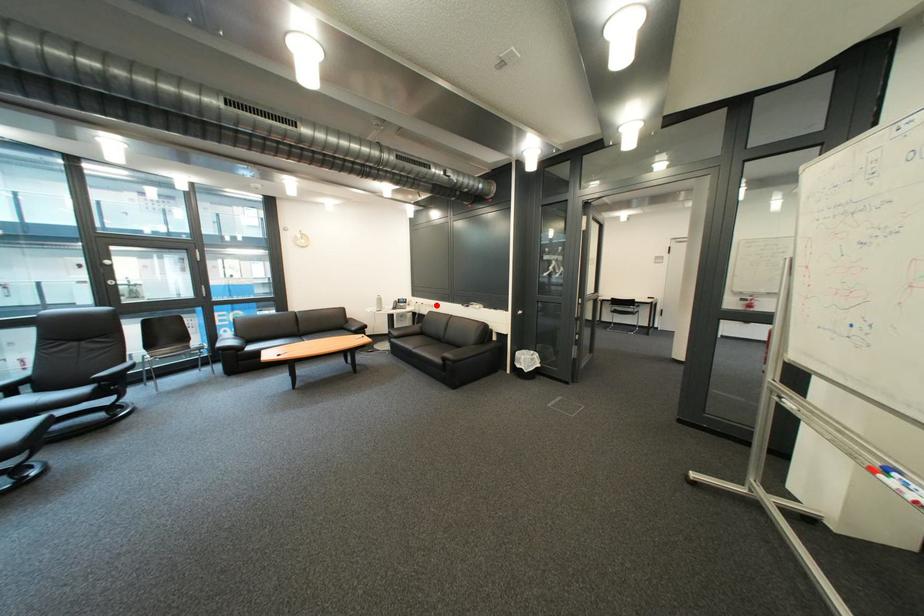
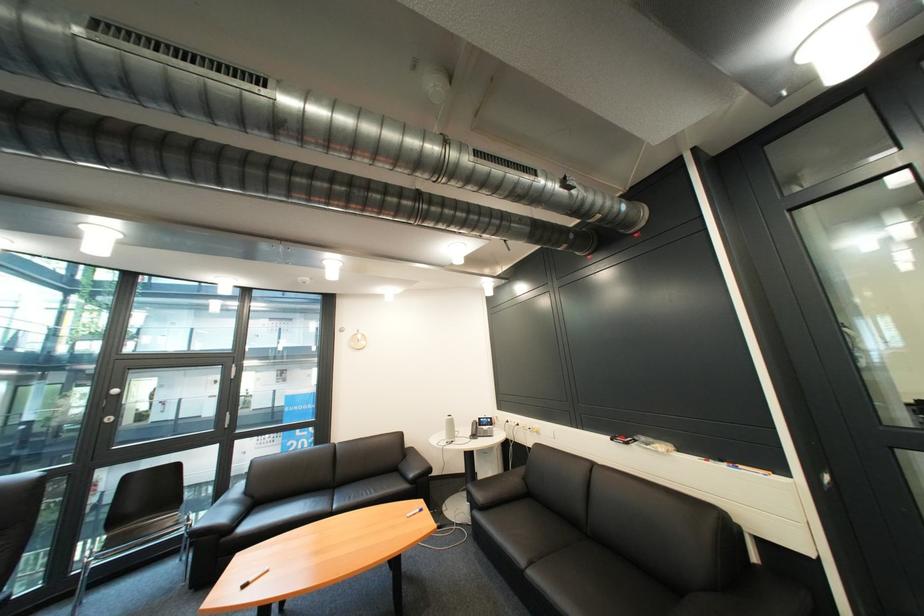
Where in the second image is the point corresponding to the highlighted location from the first image?

(531, 426)